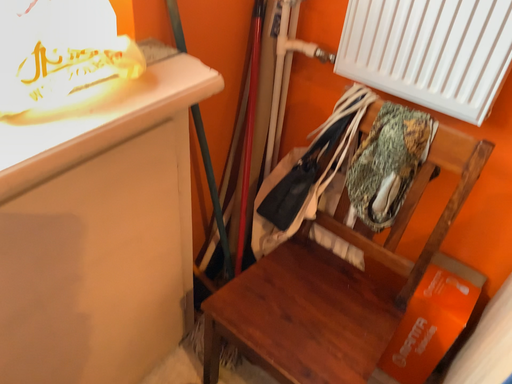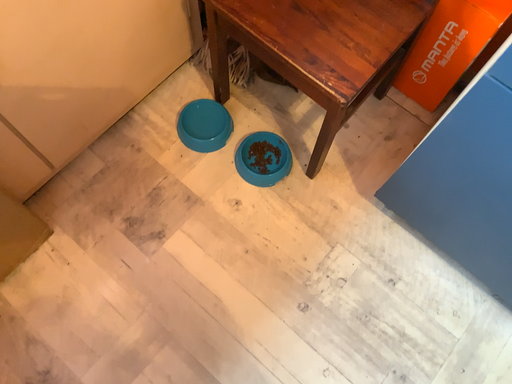
Question: Which way did the camera rotate in the video?

Choices:
 (A) rotated downward
 (B) rotated upward

Answer: (A)